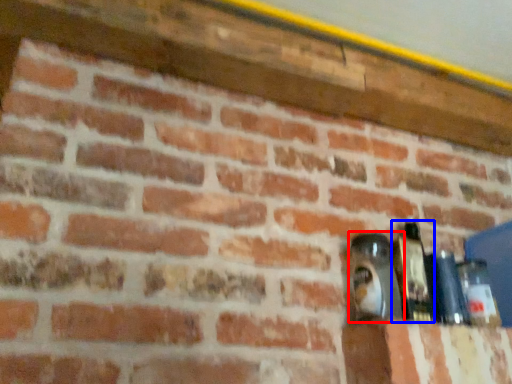
Question: Which object appears farthest to the camera in this image, bottle (highlighted by a red box) or bottle (highlighted by a blue box)?

Choices:
 (A) bottle
 (B) bottle

Answer: (B)